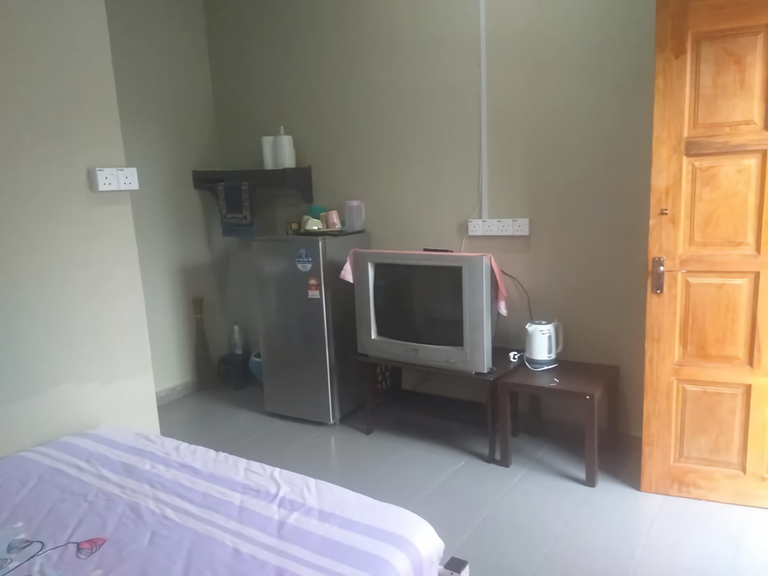
Identify the location of door. Image resolution: width=768 pixels, height=576 pixels. (709, 327).